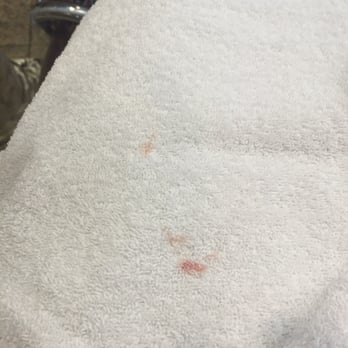
This screenshot has width=348, height=348. I want to click on tiles, so point(22,51).